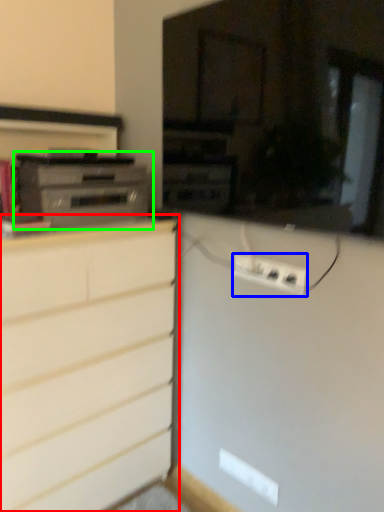
Question: Considering the real-world distances, which object is farthest from chest of drawers (highlighted by a red box)? electric outlet (highlighted by a blue box) or home appliance (highlighted by a green box)?

Choices:
 (A) electric outlet
 (B) home appliance

Answer: (A)